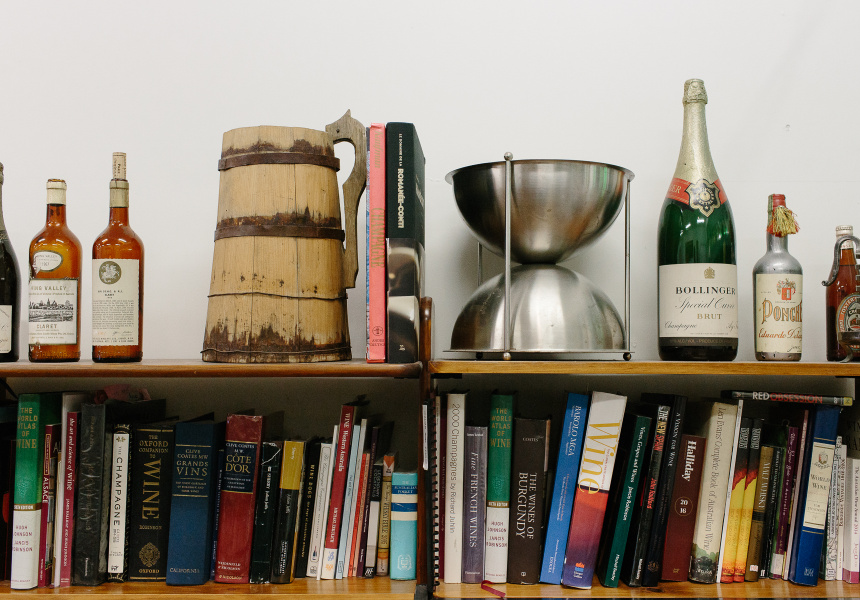
The width and height of the screenshot is (860, 600). I want to click on bottom wooden shelf with books left to right, so click(x=344, y=589), click(x=542, y=586).